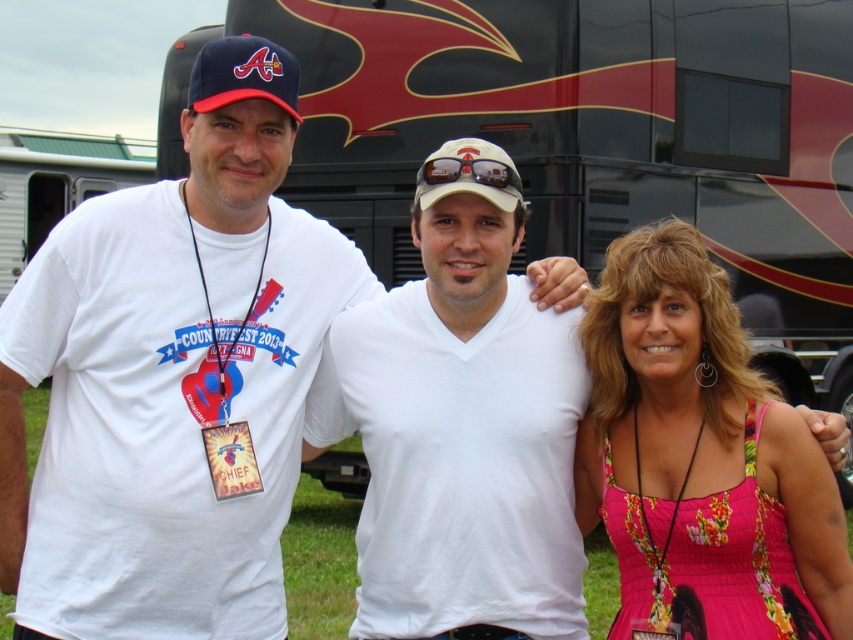
You are a photographer trying to capture a closeup shot of both the matte blue baseball cap at upper left and the white matte baseball cap at center. Given that your camera can focus on objects within a 20 inch range, will you be able to capture both caps in the same frame without adjusting your position?

The matte blue baseball cap at upper left is 24.95 inches away from the white matte baseball cap at center. Since the distance exceeds the camera focus range of 20 inches, you will need to adjust your position to ensure both caps are within the 20 inch range for proper focus.

You are standing in front of the RV and want to find the floral print dress at center. Which direction should you look relative to the matte blue baseball cap at upper left?

The floral print dress at center is located below the matte blue baseball cap at upper left, so you should look downward from the matte blue baseball cap at upper left to find it.

You are a photographer adjusting the camera settings to capture the entire scene. The camera has a fixed focal length that can only accommodate objects up to a certain width. If the floral print dress at center is wider than the matte blue baseball cap at upper left, which object might require more careful framing to ensure it fits within the camera frame?

The floral print dress at center requires more careful framing because it is wider than the matte blue baseball cap at upper left, so it might exceed the camera frame if not positioned properly.